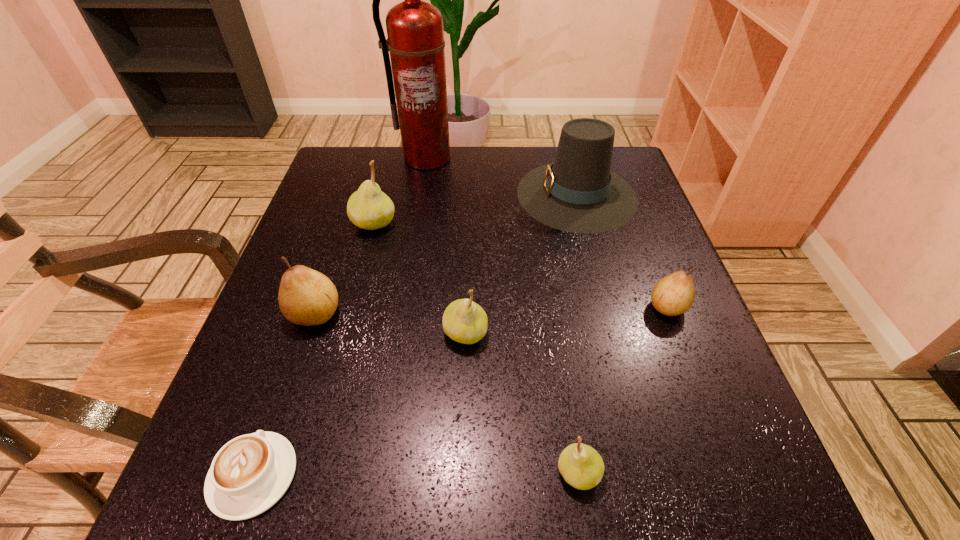
Where is `the tallest object`? This screenshot has height=540, width=960. the tallest object is located at coordinates (415, 32).

Where is `fire extinguisher`? This screenshot has width=960, height=540. fire extinguisher is located at coordinates 415,32.

Locate an element on the screen. The image size is (960, 540). gray hat is located at coordinates (578, 193).

Find the location of a particular element. Image resolution: width=960 pixels, height=540 pixels. the biggest green pear is located at coordinates (369, 208).

What are the coordinates of `the farthest green pear` in the screenshot? It's located at coord(369,208).

This screenshot has height=540, width=960. What are the coordinates of `the left brown pear` in the screenshot? It's located at (306, 297).

The image size is (960, 540). I want to click on the second nearest green pear, so point(464,321).

Find the location of `the second smallest green pear`. the second smallest green pear is located at coordinates (464, 321).

This screenshot has width=960, height=540. In order to click on the right brown pear in this screenshot , I will do `click(672, 295)`.

Where is `the smaller brown pear`? Image resolution: width=960 pixels, height=540 pixels. the smaller brown pear is located at coordinates (672, 295).